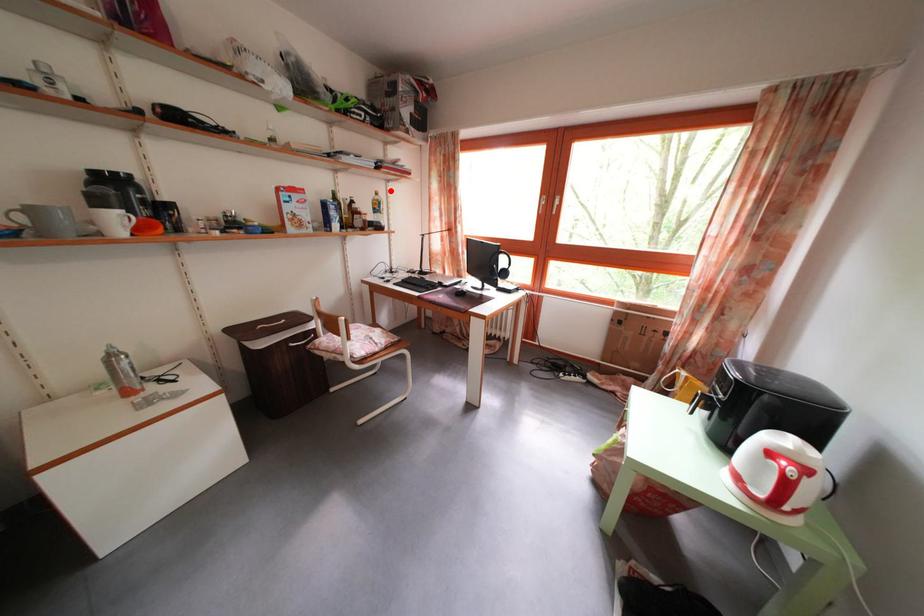
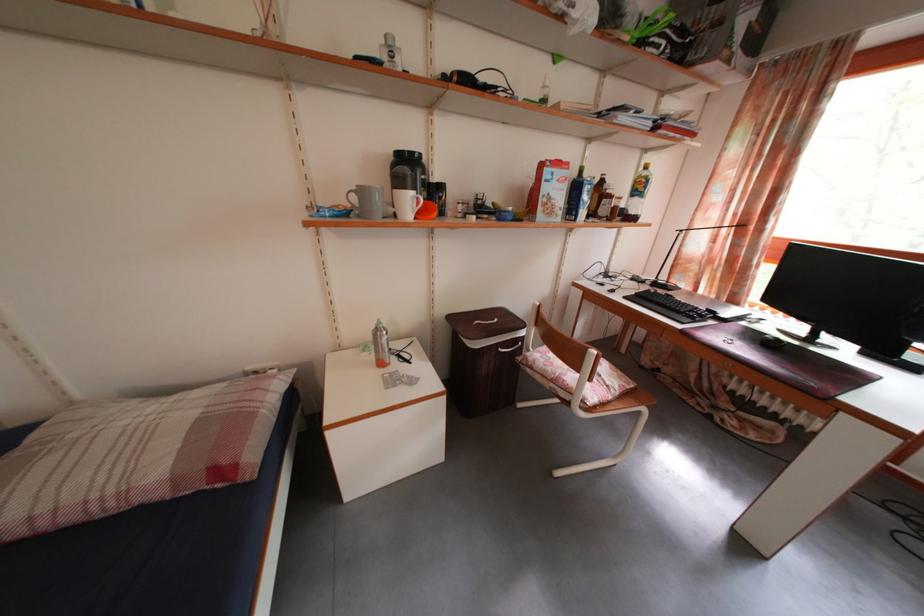
In the second image, find the point that corresponds to the highlighted location in the first image.

(643, 161)